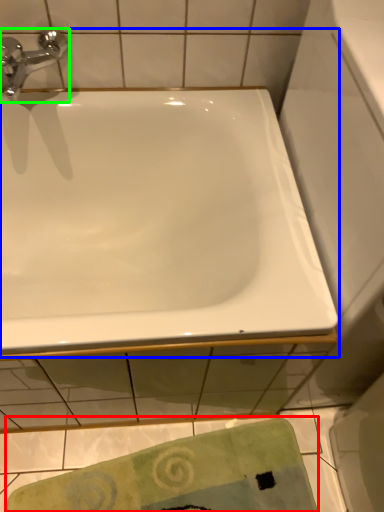
Question: Based on their relative distances, which object is nearer to beach towel (highlighted by a red box)? Choose from bathtub (highlighted by a blue box) and tap (highlighted by a green box).

Choices:
 (A) bathtub
 (B) tap

Answer: (A)